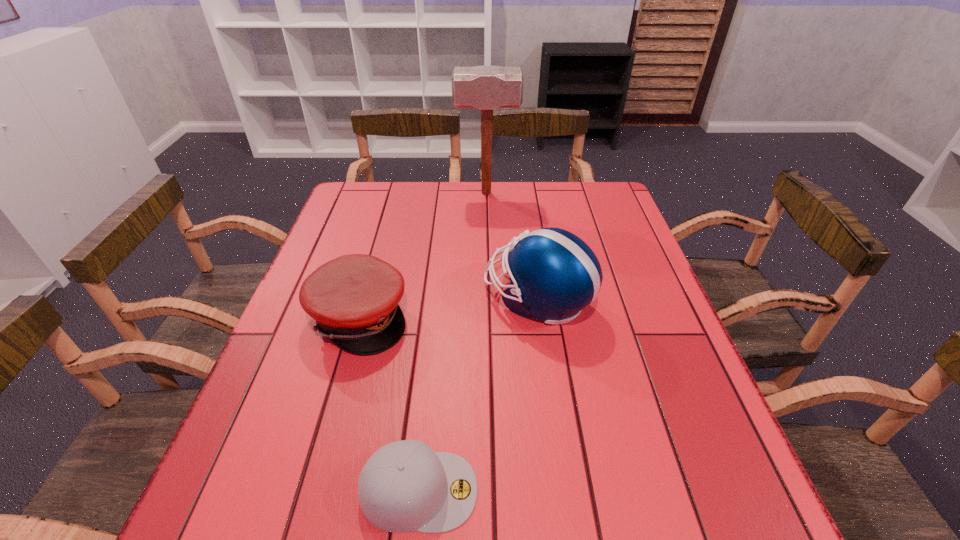
Where is `free space that is in between the shorter cap and the farther cap`? free space that is in between the shorter cap and the farther cap is located at coordinates (389, 404).

Find the location of `free space between the nearer cap and the second tallest object`. free space between the nearer cap and the second tallest object is located at coordinates (478, 394).

You are a GUI agent. You are given a task and a screenshot of the screen. Output one action in this format:
    pyautogui.click(x=<x>, y=<y>)
    Task: Click on the third closest object to the tallest object
    The height and width of the screenshot is (540, 960).
    Given the screenshot: What is the action you would take?
    pyautogui.click(x=405, y=486)

Identify which object is the second nearest to the nearest object. Please provide its 2D coordinates. Your answer should be formatted as a tuple, i.e. [(x, y)], where the tuple contains the x and y coordinates of a point satisfying the conditions above.

[(554, 274)]